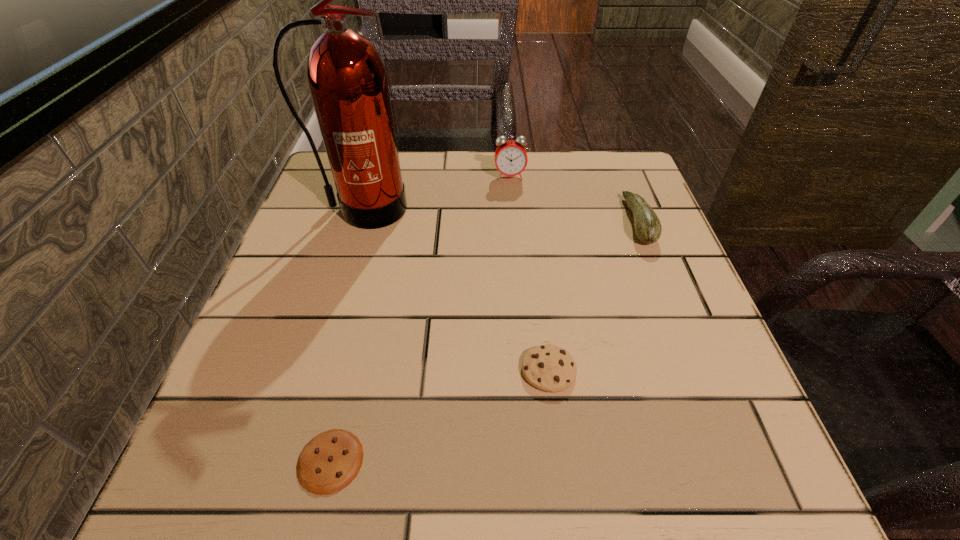
You are a GUI agent. You are given a task and a screenshot of the screen. Output one action in this format:
    pyautogui.click(x=<x>, y=<y>)
    Task: Click on the free region located on the front-facing side of the farthest object
    Image resolution: width=960 pixels, height=540 pixels.
    Given the screenshot: What is the action you would take?
    pyautogui.click(x=515, y=231)

Find the location of `vacant space positioned at the stem end of the zucchini`. vacant space positioned at the stem end of the zucchini is located at coordinates (570, 221).

Find the location of a particular element. free space located 0.060m at the stem end of the zucchini is located at coordinates (598, 221).

Locate an element on the screen. vacant space located 0.190m at the stem end of the zucchini is located at coordinates (538, 221).

Locate an element on the screen. Image resolution: width=960 pixels, height=540 pixels. vacant space located on the right of the right cookie is located at coordinates (731, 370).

Find the location of a particular element. This screenshot has width=960, height=540. vacant space located on the back of the left cookie is located at coordinates (362, 327).

Identify the location of fire extinguisher present at the far edge. (347, 79).

Identify the location of alarm clock positioned at the far edge. Image resolution: width=960 pixels, height=540 pixels. (511, 159).

You are a GUI agent. You are given a task and a screenshot of the screen. Output one action in this format:
    pyautogui.click(x=<x>, y=<y>)
    Task: Click on the zucchini that is at the far edge
    This screenshot has height=540, width=960.
    Given the screenshot: What is the action you would take?
    pyautogui.click(x=648, y=228)

The image size is (960, 540). Find the location of `object situated at the near edge`. object situated at the near edge is located at coordinates (329, 462).